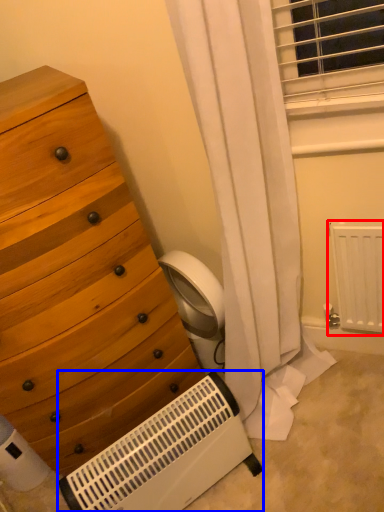
Question: Which of the following is the farthest to the observer, radiator (highlighted by a red box) or heater (highlighted by a blue box)?

Choices:
 (A) radiator
 (B) heater

Answer: (A)